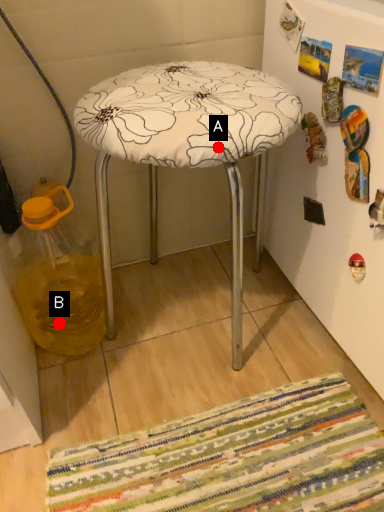
Question: Two points are circled on the image, labeled by A and B beside each circle. Which point appears farthest from the camera in this image?

Choices:
 (A) A is further
 (B) B is further

Answer: (B)